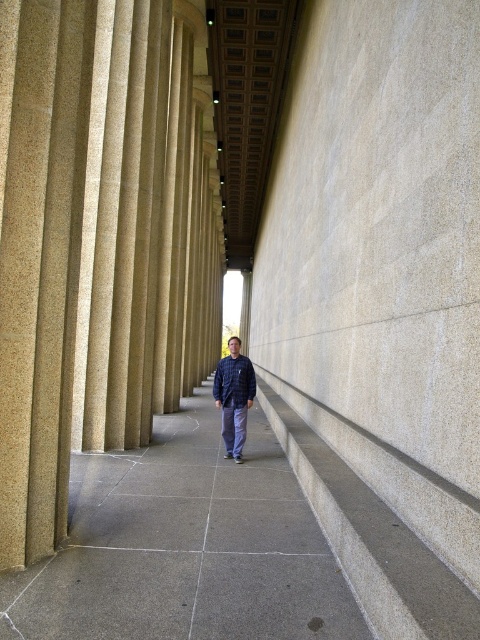
Can you confirm if gray concrete pavement at center is thinner than gray concrete stairs at center?

Incorrect, gray concrete pavement at center's width is not less than gray concrete stairs at center's.

Is point (110, 516) positioned in front of point (344, 538)?

No, (110, 516) is behind (344, 538).

Does point (21, 588) come behind point (369, 588)?

Yes.

At what (x,y) coordinates should I click in order to perform the action: click on gray concrete pavement at center. Please return your answer as a coordinate pair (x, y). The height and width of the screenshot is (640, 480). Looking at the image, I should click on (184, 547).

Does point (230, 444) come farther from viewer compared to point (219, 381)?

Yes, point (230, 444) is behind point (219, 381).

Is point (228, 390) in front of point (252, 376)?

Yes, point (228, 390) is in front of point (252, 376).

Where is `dark blue jacket at center`? dark blue jacket at center is located at coordinates 233,397.

Between gray concrete pavement at center and dark blue cotton sweatshirt at center, which one is positioned lower?

gray concrete pavement at center is below.

Does point (146, 497) come behind point (228, 376)?

That is False.

Where is `gray concrete pavement at center`? gray concrete pavement at center is located at coordinates (184, 547).